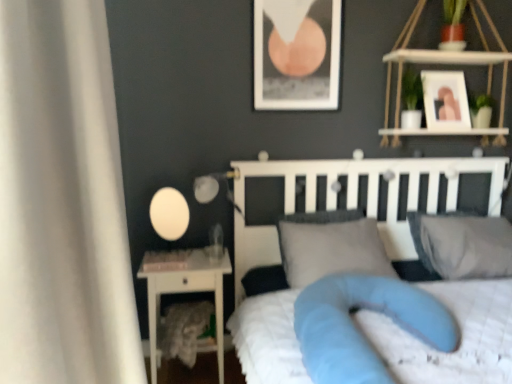
The image size is (512, 384). Describe the element at coordinates (62, 201) in the screenshot. I see `white fabric curtain at left` at that location.

Describe the element at coordinates (445, 100) in the screenshot. I see `white glossy picture frame at upper right, the second picture frame viewed from the left` at that location.

Describe the element at coordinates (442, 63) in the screenshot. I see `white wood shelf at upper right` at that location.

What do you see at coordinates (214, 188) in the screenshot? I see `matte white glass at left, the 2th table lamp in the left-to-right sequence` at bounding box center [214, 188].

Where is `white fabric curtain at left`? The width and height of the screenshot is (512, 384). white fabric curtain at left is located at coordinates (62, 201).

How different are the orientations of gray fabric pillow at center, the 2th pillow positioned from the right, and white glossy nightstand at left in degrees?

3.12 degrees separate the facing orientations of gray fabric pillow at center, the 2th pillow positioned from the right, and white glossy nightstand at left.

Does gray fabric pillow at center, the 2th pillow positioned from the right, appear on the left side of white glossy nightstand at left?

No, gray fabric pillow at center, the 2th pillow positioned from the right, is not to the left of white glossy nightstand at left.

Which object is closer to the camera, gray fabric pillow at center, the 1th pillow when ordered from left to right, or white glossy nightstand at left?

Positioned in front is gray fabric pillow at center, the 1th pillow when ordered from left to right.

Is white matte table lamp at left, positioned as the 1th table lamp in left-to-right order, thinner than white soft bed at center?

Yes.

Which object is positioned more to the right, white matte table lamp at left, the 2th table lamp from the right, or white soft bed at center?

Positioned to the right is white soft bed at center.

Considering the sizes of objects white matte table lamp at left, positioned as the 1th table lamp in left-to-right order, and white soft bed at center in the image provided, who is bigger, white matte table lamp at left, positioned as the 1th table lamp in left-to-right order, or white soft bed at center?

Bigger between the two is white soft bed at center.

Which of these two, gray fabric pillow at center, the 1th pillow when ordered from left to right, or white glossy picture frame at upper right, the second picture frame viewed from the left, is wider?

gray fabric pillow at center, the 1th pillow when ordered from left to right, is wider.

Could you tell me if gray fabric pillow at center, the 1th pillow when ordered from left to right, is facing white glossy picture frame at upper right, the first picture frame from the right?

No, gray fabric pillow at center, the 1th pillow when ordered from left to right, does not turn towards white glossy picture frame at upper right, the first picture frame from the right.

Which object is positioned more to the right, gray fabric pillow at center, the 2th pillow positioned from the right, or white glossy picture frame at upper right, the second picture frame viewed from the left?

Positioned to the right is white glossy picture frame at upper right, the second picture frame viewed from the left.

Can you confirm if gray fabric pillow at center, the 1th pillow when ordered from left to right, is taller than white glossy picture frame at upper right, the first picture frame from the right?

No, gray fabric pillow at center, the 1th pillow when ordered from left to right, is not taller than white glossy picture frame at upper right, the first picture frame from the right.

Is white matte table lamp at left, the 2th table lamp from the right, not near matte black picture frame at upper center, marked as the second picture frame in a right-to-left arrangement?

white matte table lamp at left, the 2th table lamp from the right, is near matte black picture frame at upper center, marked as the second picture frame in a right-to-left arrangement, not far away.

From a real-world perspective, who is located lower, white matte table lamp at left, the 2th table lamp from the right, or matte black picture frame at upper center, marked as the second picture frame in a right-to-left arrangement?

white matte table lamp at left, the 2th table lamp from the right.

Does white matte table lamp at left, positioned as the 1th table lamp in left-to-right order, appear on the left side of matte black picture frame at upper center, marked as the second picture frame in a right-to-left arrangement?

Correct, you'll find white matte table lamp at left, positioned as the 1th table lamp in left-to-right order, to the left of matte black picture frame at upper center, marked as the second picture frame in a right-to-left arrangement.

Which is closer to the camera, [165,237] or [285,60]?

Point [165,237] is positioned closer to the camera compared to point [285,60].

Consider the image. What's the angular difference between matte black picture frame at upper center, marked as the second picture frame in a right-to-left arrangement, and blue fabric mattress at center's facing directions?

matte black picture frame at upper center, marked as the second picture frame in a right-to-left arrangement, and blue fabric mattress at center are facing 2.6 degrees away from each other.

Is matte black picture frame at upper center, which is the 1th picture frame from left to right, looking in the opposite direction of blue fabric mattress at center?

matte black picture frame at upper center, which is the 1th picture frame from left to right, is not turned away from blue fabric mattress at center.

Does matte black picture frame at upper center, which is the 1th picture frame from left to right, have a greater width compared to blue fabric mattress at center?

In fact, matte black picture frame at upper center, which is the 1th picture frame from left to right, might be narrower than blue fabric mattress at center.

Is blue fabric mattress at center completely or partially inside matte black picture frame at upper center, which is the 1th picture frame from left to right?

No, blue fabric mattress at center is not a part of matte black picture frame at upper center, which is the 1th picture frame from left to right.

Which is more to the right, matte white glass at left, the 2th table lamp in the left-to-right sequence, or blue fabric mattress at center?

blue fabric mattress at center.

Relative to blue fabric mattress at center, is matte white glass at left, the 2th table lamp in the left-to-right sequence, in front or behind?

matte white glass at left, the 2th table lamp in the left-to-right sequence, is behind blue fabric mattress at center.

From a real-world perspective, which object stands above the other?

In real-world perspective, matte white glass at left, the 2th table lamp in the left-to-right sequence, is above.

Is matte black picture frame at upper center, marked as the second picture frame in a right-to-left arrangement, shorter than white soft bed at center?

Yes, matte black picture frame at upper center, marked as the second picture frame in a right-to-left arrangement, is shorter than white soft bed at center.

Which of these two, matte black picture frame at upper center, marked as the second picture frame in a right-to-left arrangement, or white soft bed at center, is smaller?

matte black picture frame at upper center, marked as the second picture frame in a right-to-left arrangement, is smaller.

Identify the location of bed that appears below the matte black picture frame at upper center, which is the 1th picture frame from left to right (from the image's perspective). (375, 186).

How different are the orientations of matte black picture frame at upper center, which is the 1th picture frame from left to right, and white soft bed at center in degrees?

The facing directions of matte black picture frame at upper center, which is the 1th picture frame from left to right, and white soft bed at center are 1.04 degrees apart.

The image size is (512, 384). I want to click on nightstand below the gray fabric pillow at center, the 1th pillow when ordered from left to right (from the image's perspective), so click(x=187, y=292).

Where is `bed in front of the white matte table lamp at left, positioned as the 1th table lamp in left-to-right order`? bed in front of the white matte table lamp at left, positioned as the 1th table lamp in left-to-right order is located at coordinates (375, 186).

Considering their positions, is white glossy nightstand at left positioned further to white fabric curtain at left than white soft bed at center?

white soft bed at center lies further to white fabric curtain at left than the other object.

Considering their positions, is matte white glass at left, the 2th table lamp in the left-to-right sequence, positioned closer to white fabric curtain at left than white matte table lamp at left, positioned as the 1th table lamp in left-to-right order?

white matte table lamp at left, positioned as the 1th table lamp in left-to-right order, is closer to white fabric curtain at left.

Which object lies further to the anchor point matte white glass at left, the 1th table lamp viewed from the right, white matte table lamp at left, positioned as the 1th table lamp in left-to-right order, or white wood shelf at upper right?

Based on the image, white wood shelf at upper right appears to be further to matte white glass at left, the 1th table lamp viewed from the right.

When comparing their distances from white wood shelf at upper right, does matte white glass at left, the 1th table lamp viewed from the right, or white fabric curtain at left seem closer?

matte white glass at left, the 1th table lamp viewed from the right.

Considering their positions, is white wood shelf at upper right positioned closer to white matte table lamp at left, positioned as the 1th table lamp in left-to-right order, than white fabric curtain at left?

white fabric curtain at left.

When comparing their distances from gray fabric pillow at upper right, arranged as the 2th pillow when viewed from the left, does matte black picture frame at upper center, marked as the second picture frame in a right-to-left arrangement, or white glossy nightstand at left seem further?

white glossy nightstand at left.

Based on their spatial positions, is gray fabric pillow at center, the 1th pillow when ordered from left to right, or white glossy nightstand at left closer to white fabric curtain at left?

white glossy nightstand at left is closer to white fabric curtain at left.

When comparing their distances from white fabric curtain at left, does matte white glass at left, the 1th table lamp viewed from the right, or white glossy nightstand at left seem further?

matte white glass at left, the 1th table lamp viewed from the right, lies further to white fabric curtain at left than the other object.

Identify the location of nightstand between white matte table lamp at left, the 2th table lamp from the right, and gray fabric pillow at upper right, marked as the 1th pillow in a right-to-left arrangement. The image size is (512, 384). (187, 292).

Image resolution: width=512 pixels, height=384 pixels. What are the coordinates of `nightstand positioned between white fabric curtain at left and white matte table lamp at left, positioned as the 1th table lamp in left-to-right order, from near to far` in the screenshot? It's located at (187, 292).

Find the location of a particular element. The height and width of the screenshot is (384, 512). shelf that lies between matte black picture frame at upper center, marked as the second picture frame in a right-to-left arrangement, and gray fabric pillow at center, the 1th pillow when ordered from left to right, from top to bottom is located at coordinates (442, 63).

The height and width of the screenshot is (384, 512). In order to click on mattress positioned between white soft bed at center and white glossy nightstand at left from near to far in this screenshot , I will do pos(461,336).